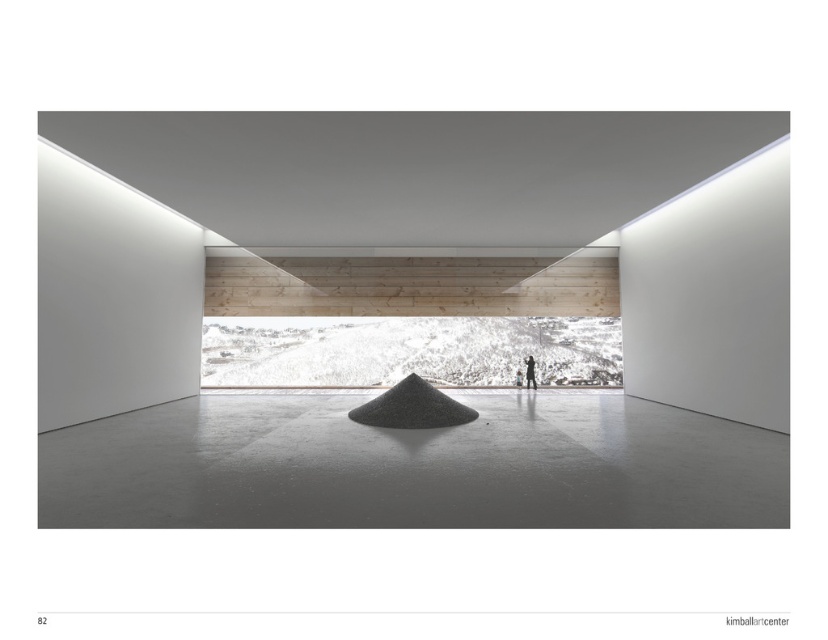
You are a landscape designer planning to place a small statue on the gray polished concrete at center. Considering the height of the black gravel mound at center, will the statue be visible from above the mound?

The gray polished concrete at center is not as tall as the black gravel mound at center, so the statue placed on the gray polished concrete at center will be lower than the mound. Therefore, the statue might be partially or fully obscured by the black gravel mound at center depending on the statue height.

You are a visitor standing in the minimalist interior space. You notice a black gravel mound at center and a matte black figure at center. Which object is taller?

The matte black figure at center is taller than the black gravel mound at center.

You are standing in the minimalist interior space. There is a point marked at coordinates point (595, 474). If you want to place a 3.5 meter long sofa in this space, can you position it so that the sofa extends from your current position to that point? Explain your reasoning.

The distance between you and point (595, 474) is 4.19 meters. Since the sofa is only 3.5 meters long, it can comfortably fit within that distance. Therefore, yes, you can position the sofa from your current position to that point as the available space is longer than the sofa.